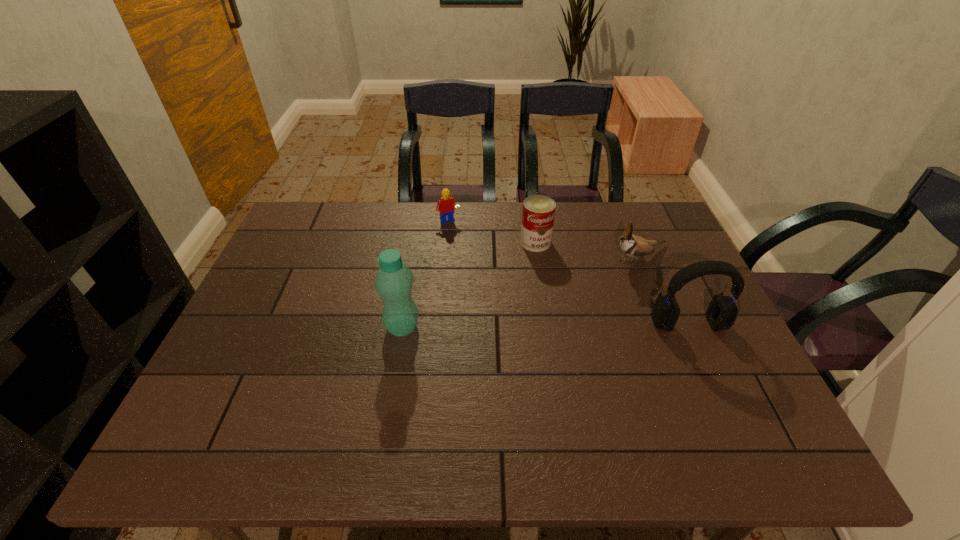
Locate an element on the screen. Image resolution: width=960 pixels, height=540 pixels. Lego present at the far edge is located at coordinates (446, 204).

Find the location of a particular element. The width and height of the screenshot is (960, 540). headset that is positioned at the right edge is located at coordinates (722, 311).

Identify the location of bird that is positioned at the right edge. point(631,245).

Find the location of a particular element. This screenshot has height=540, width=960. object that is at the far right corner is located at coordinates (631, 245).

Locate an element on the screen. The image size is (960, 540). vacant space at the far edge of the desktop is located at coordinates (362, 231).

The width and height of the screenshot is (960, 540). Find the location of `vacant area at the near edge`. vacant area at the near edge is located at coordinates (276, 413).

At what (x,y) coordinates should I click in order to perform the action: click on vacant space at the left edge of the desktop. Please return your answer as a coordinate pair (x, y). Looking at the image, I should click on (258, 330).

In order to click on free region at the right edge of the desktop in this screenshot , I will do `click(704, 340)`.

Find the location of a particular element. This screenshot has width=960, height=540. vacant space at the far left corner of the desktop is located at coordinates (316, 232).

In the image, there is a desktop. At what (x,y) coordinates should I click in order to perform the action: click on free region at the near left corner. Please return your answer as a coordinate pair (x, y). Image resolution: width=960 pixels, height=540 pixels. Looking at the image, I should click on (215, 395).